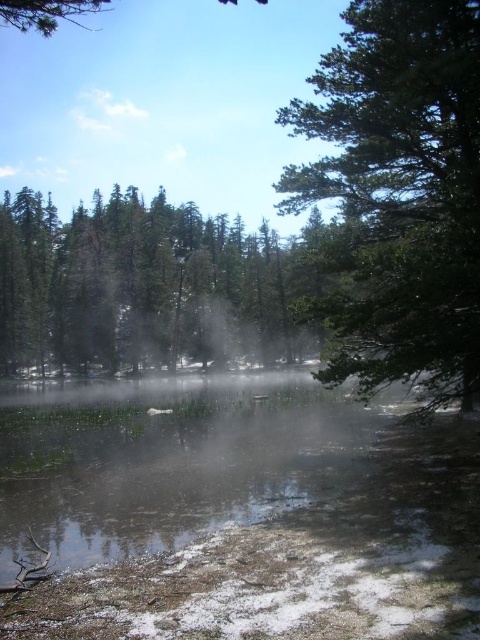
Question: Can you confirm if green textured tree at upper right is positioned to the right of green matte trees at center?

Choices:
 (A) no
 (B) yes

Answer: (B)

Question: Is green textured tree at upper right to the right of green matte trees at center from the viewer's perspective?

Choices:
 (A) yes
 (B) no

Answer: (A)

Question: Does green textured tree at upper right appear on the right side of green matte trees at center?

Choices:
 (A) no
 (B) yes

Answer: (B)

Question: Which of the following is the closest to the observer?

Choices:
 (A) green textured tree at upper right
 (B) green matte trees at center

Answer: (A)

Question: Which object is closer to the camera taking this photo?

Choices:
 (A) green textured tree at upper right
 (B) green matte trees at center

Answer: (A)

Question: Which point is farther from the camera taking this photo?

Choices:
 (A) (478, 228)
 (B) (80, 209)

Answer: (B)